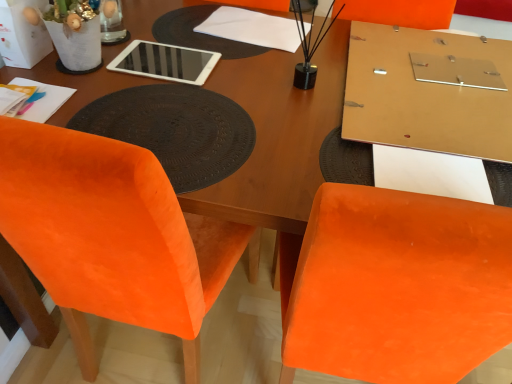
Question: Is there a large distance between velvet orange chair at lower left and white paper bag at upper left?

Choices:
 (A) no
 (B) yes

Answer: (A)

Question: Can you confirm if velvet orange chair at lower left is thinner than white paper bag at upper left?

Choices:
 (A) yes
 (B) no

Answer: (B)

Question: Is velvet orange chair at lower left not within white paper bag at upper left?

Choices:
 (A) no
 (B) yes

Answer: (B)

Question: Does velvet orange chair at lower left lie in front of white paper bag at upper left?

Choices:
 (A) yes
 (B) no

Answer: (A)

Question: From a real-world perspective, is velvet orange chair at lower left physically above white paper bag at upper left?

Choices:
 (A) no
 (B) yes

Answer: (A)

Question: In the image, is white glossy tablet at upper center on the left side or the right side of matte gold board at upper right?

Choices:
 (A) right
 (B) left

Answer: (B)

Question: From a real-world perspective, is white glossy tablet at upper center positioned above or below matte gold board at upper right?

Choices:
 (A) below
 (B) above

Answer: (A)

Question: From their relative heights in the image, would you say white glossy tablet at upper center is taller or shorter than matte gold board at upper right?

Choices:
 (A) tall
 (B) short

Answer: (B)

Question: Considering their positions, is white glossy tablet at upper center located in front of or behind matte gold board at upper right?

Choices:
 (A) front
 (B) behind

Answer: (B)

Question: In terms of width, does velvet orange chair at lower left look wider or thinner when compared to white glossy tablet at upper center?

Choices:
 (A) thin
 (B) wide

Answer: (B)

Question: From a real-world perspective, is velvet orange chair at lower left above or below white glossy tablet at upper center?

Choices:
 (A) above
 (B) below

Answer: (B)

Question: Considering the positions of point (111, 243) and point (212, 64), is point (111, 243) closer or farther from the camera than point (212, 64)?

Choices:
 (A) farther
 (B) closer

Answer: (B)

Question: From the image's perspective, is velvet orange chair at lower left positioned above or below white glossy tablet at upper center?

Choices:
 (A) below
 (B) above

Answer: (A)

Question: Considering the positions of brown textured placemat at center and white glossy tablet at upper center in the image, is brown textured placemat at center wider or thinner than white glossy tablet at upper center?

Choices:
 (A) thin
 (B) wide

Answer: (B)

Question: Is brown textured placemat at center bigger or smaller than white glossy tablet at upper center?

Choices:
 (A) big
 (B) small

Answer: (A)